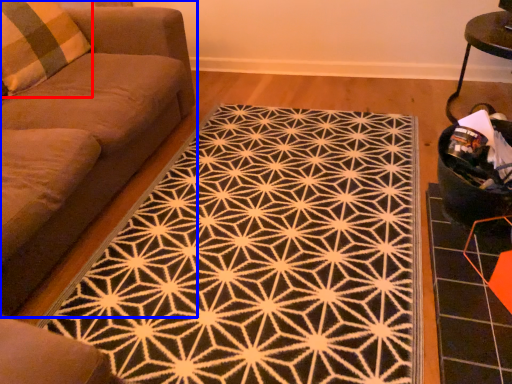
Question: Which object is closer to the camera taking this photo, pillow (highlighted by a red box) or studio couch (highlighted by a blue box)?

Choices:
 (A) pillow
 (B) studio couch

Answer: (B)